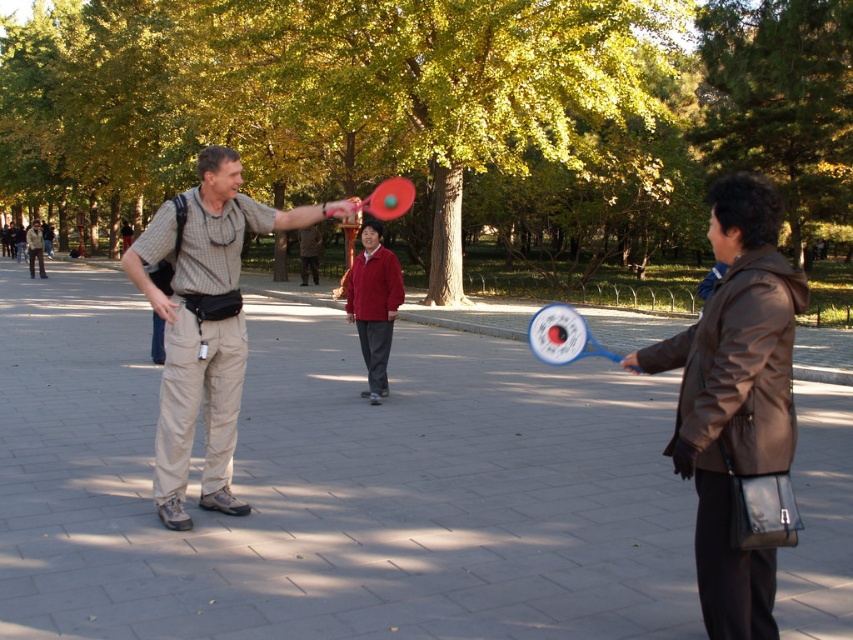
Question: Can you confirm if brown leather jacket at right is positioned to the right of khaki cotton pants at center?

Choices:
 (A) yes
 (B) no

Answer: (A)

Question: Which point is farther to the camera?

Choices:
 (A) khaki cotton pants at center
 (B) brown leather jacket at right

Answer: (A)

Question: Does brown leather jacket at right have a lesser width compared to khaki cotton pants at center?

Choices:
 (A) no
 (B) yes

Answer: (B)

Question: Which point is farther from the camera taking this photo?

Choices:
 (A) (207, 388)
 (B) (729, 204)

Answer: (A)

Question: Does brown leather jacket at right appear over khaki cotton pants at center?

Choices:
 (A) yes
 (B) no

Answer: (B)